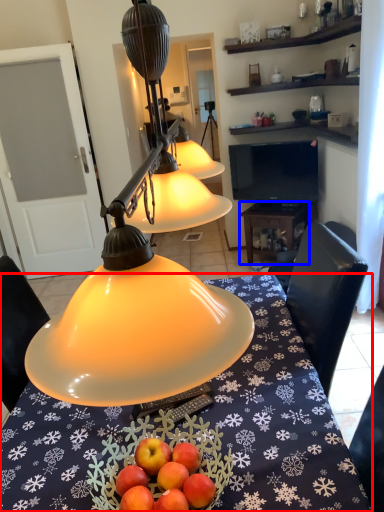
Question: Which of the following is the closest to the observer, desk (highlighted by a red box) or table (highlighted by a blue box)?

Choices:
 (A) desk
 (B) table

Answer: (A)